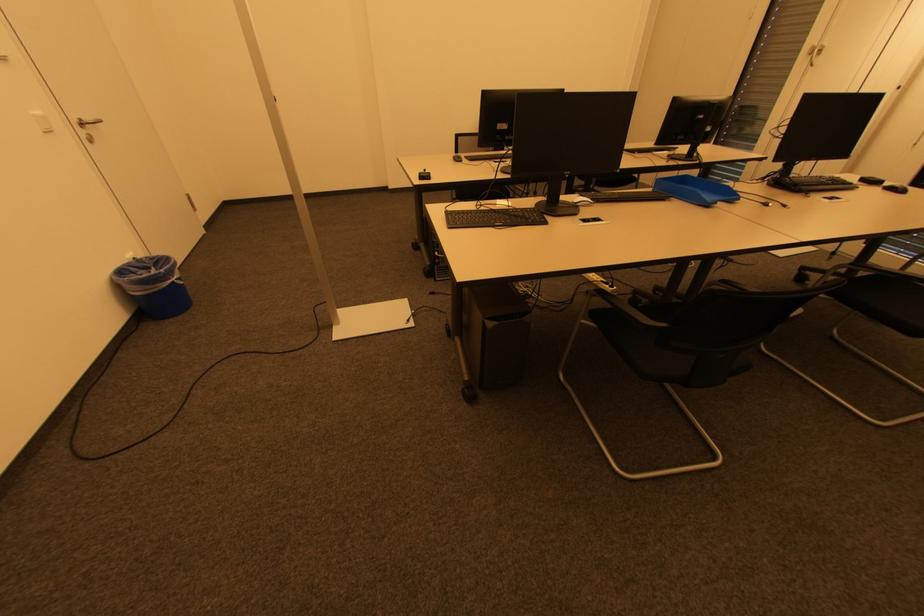
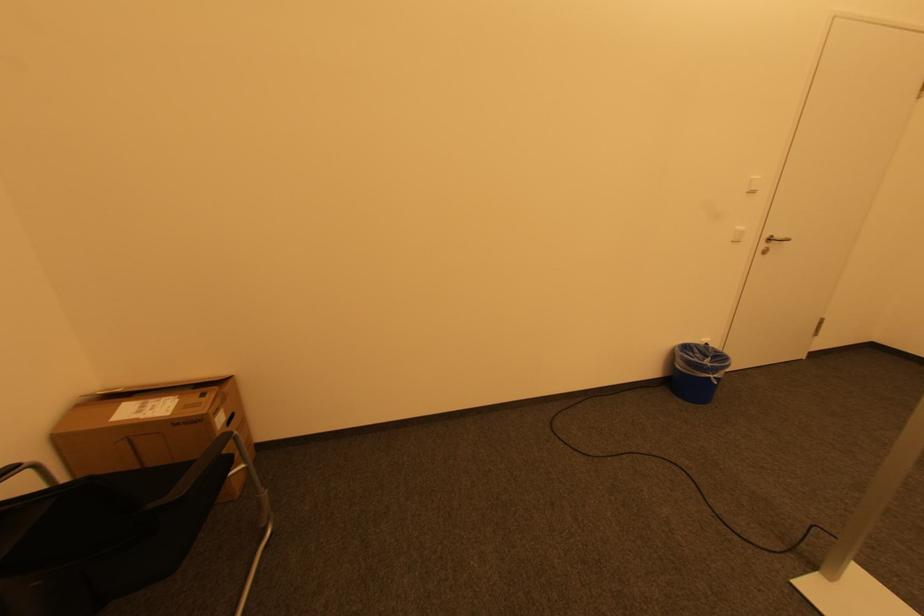
Based on the continuous images, in which direction is the camera rotating?

The rotation direction of the camera is left-down.